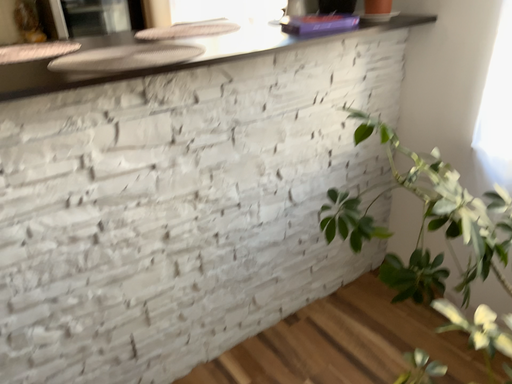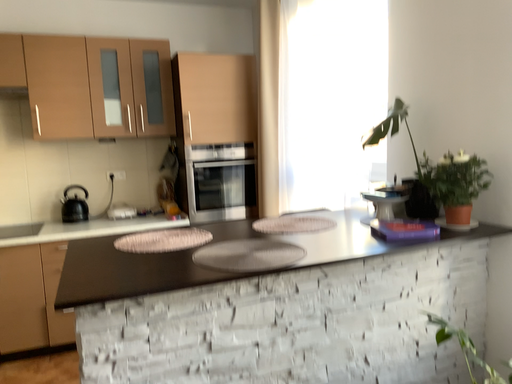
Question: Which way did the camera rotate in the video?

Choices:
 (A) rotated right
 (B) rotated left

Answer: (B)